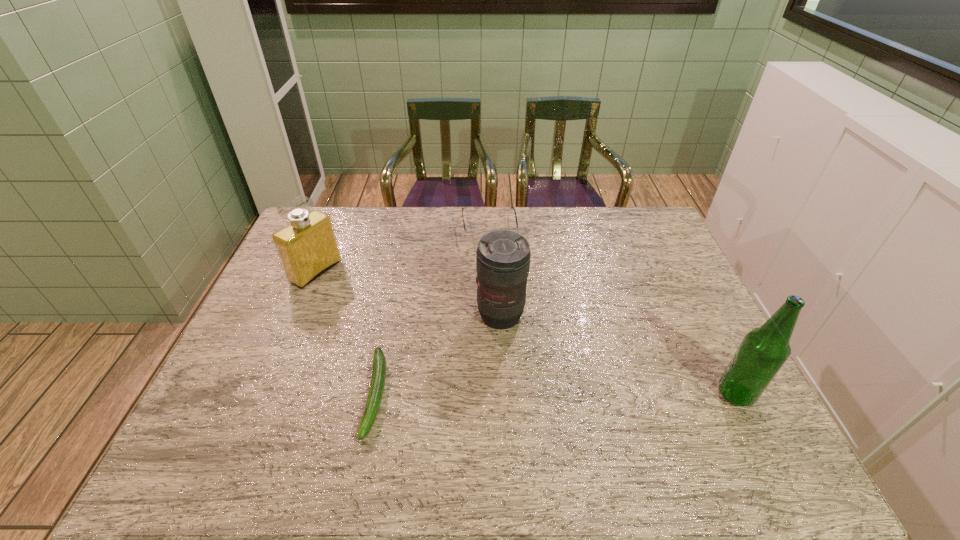
Image resolution: width=960 pixels, height=540 pixels. Find the location of `zucchini`. zucchini is located at coordinates (375, 394).

Find the location of a particular element. The width and height of the screenshot is (960, 540). the second object from left to right is located at coordinates (375, 394).

Find the location of a particular element. beer bottle is located at coordinates (763, 351).

Where is `the rightmost object`? This screenshot has width=960, height=540. the rightmost object is located at coordinates (763, 351).

What are the coordinates of `the leftmost object` in the screenshot? It's located at (307, 247).

This screenshot has width=960, height=540. What are the coordinates of `perfume` in the screenshot? It's located at (307, 247).

This screenshot has height=540, width=960. What are the coordinates of `telephoto lens` in the screenshot? It's located at (503, 257).

Image resolution: width=960 pixels, height=540 pixels. I want to click on the farthest object, so click(x=474, y=236).

I want to click on the fourth tallest object, so click(x=474, y=236).

Identify the location of free point located on the label of the rightmost object. (639, 394).